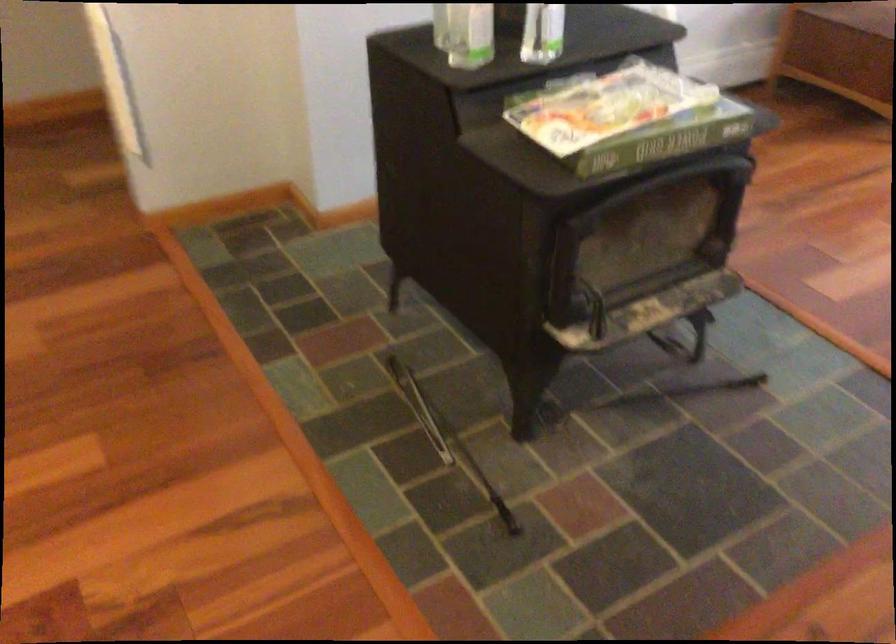
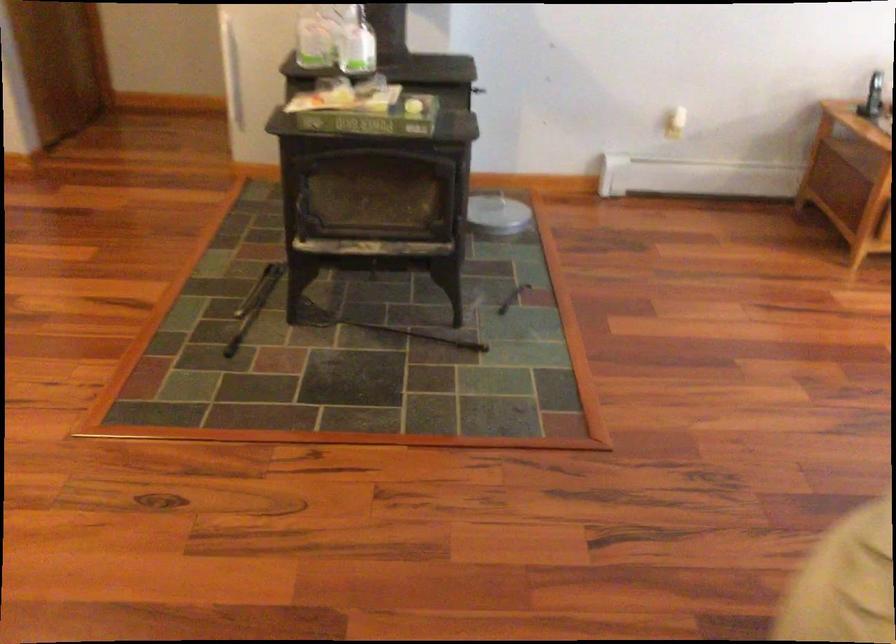
Locate, in the second image, the point that corresponds to point (661, 128) in the first image.

(366, 116)